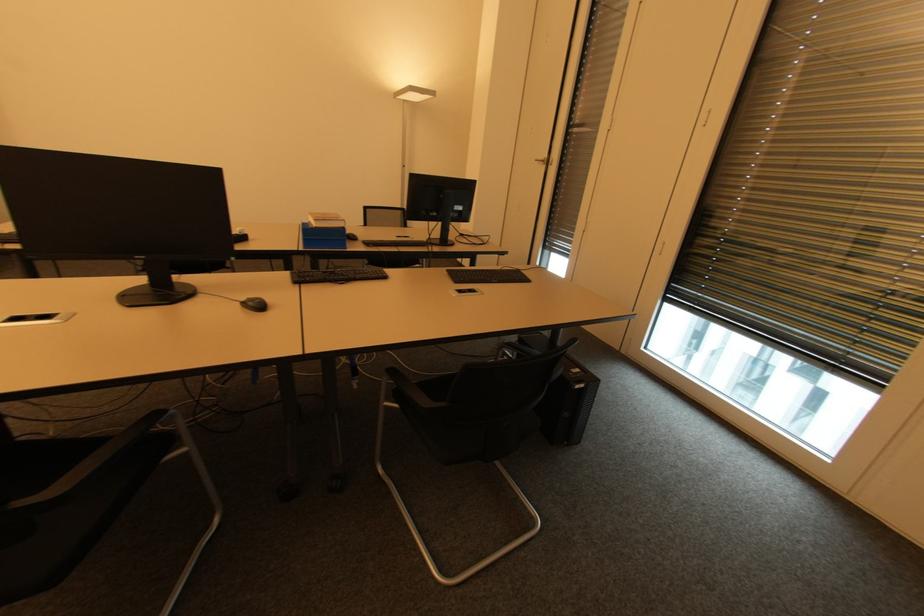
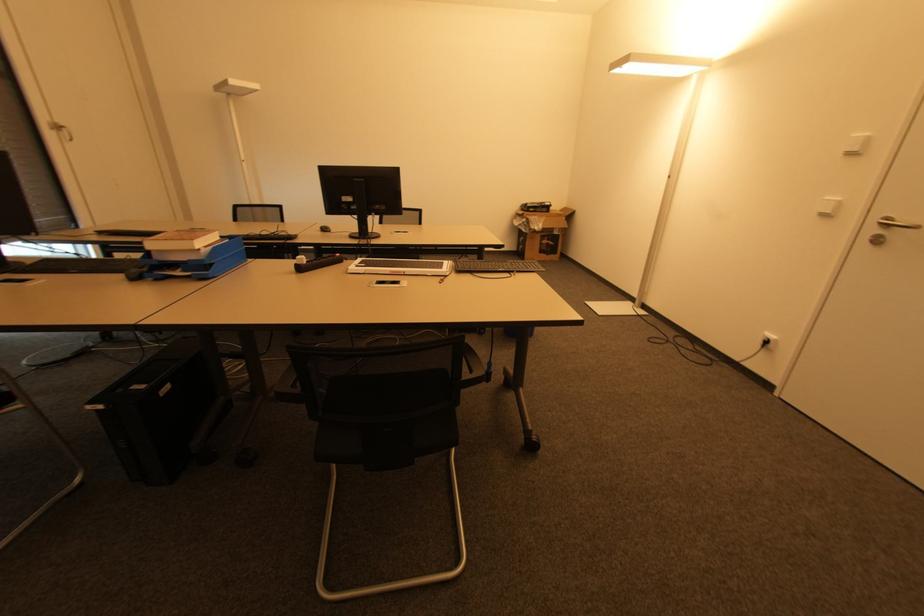
In the second image, find the point that corresponds to pixel 261 307 in the first image.

(325, 230)